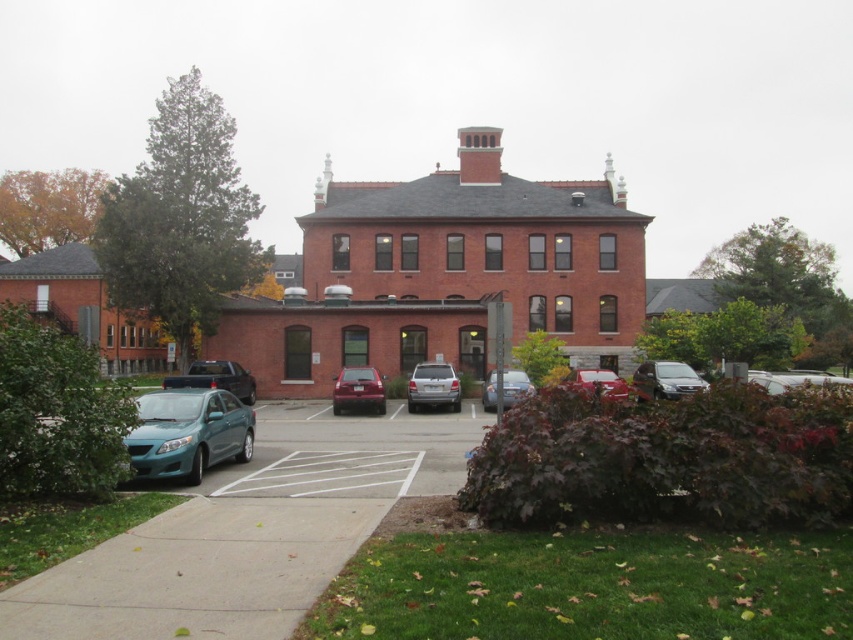
You are standing at the viewer position in front of the building. You want to walk to the smooth concrete pavement at lower center. How many steps would you need to take if each step covers 0.75 meters?

The distance between you and the smooth concrete pavement at lower center is 4.59 meters. Since each step covers 0.75 meters, dividing 4.59 by 0.75 gives approximately 6.12 steps. Therefore, you would need to take about 6 steps to reach the smooth concrete pavement at lower center.

You are a delivery driver who needs to park your teal matte car at lower left in a parking spot that is only 1.8 meters wide. The parking spot is next to the satin silver minivan at center. According to the scene, will your car fit into the spot without overlapping the minivan?

The teal matte car at lower left is narrower than the satin silver minivan at center. Since the parking spot is 1.8 meters wide, and the car is narrower than the minivan, it should fit without overlapping, provided the minivan is parked properly within its own space.

You are a delivery driver who needs to park your teal matte car at lower left in a parking space that is only 4 meters long. The parking space is directly in front of the satin silver minivan at center. Can your car fit in the space if the minivan is already occupying part of it?

The teal matte car at lower left is shorter than the satin silver minivan at center. Since the parking space is 4 meters long, and the minivan is longer, the car may still fit depending on the exact length difference. However, without knowing the exact lengths, it is uncertain. Please check the dimensions before parking.